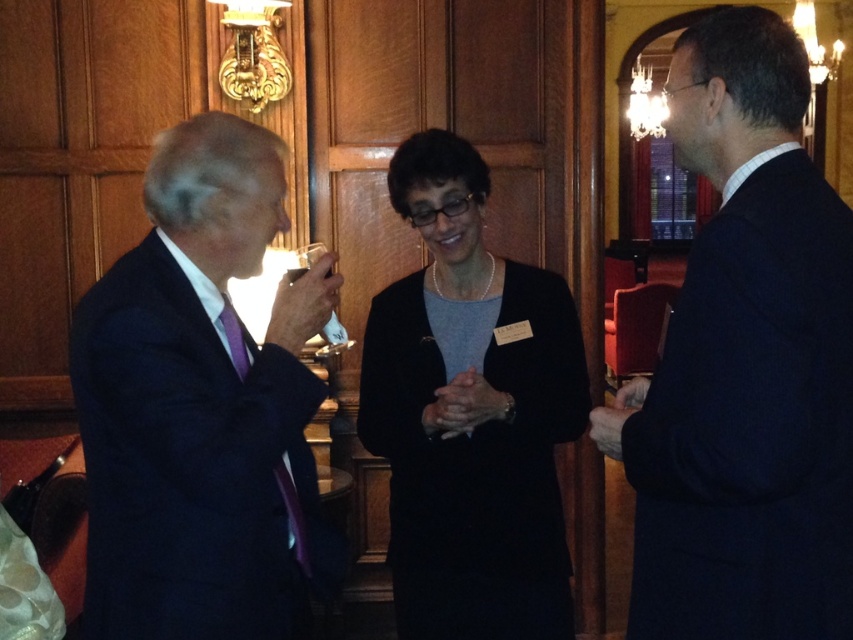
Between dark blue suit at left and matte black cardigan at center, which one appears on the right side from the viewer's perspective?

Positioned to the right is matte black cardigan at center.

Is point (291, 611) more distant than point (389, 432)?

That is False.

Is point (225, 420) positioned before point (450, 554)?

Yes, point (225, 420) is closer to viewer.

I want to click on dark blue suit at left, so click(202, 406).

Consider the image. Does dark blue suit at right have a greater height compared to matte black cardigan at center?

No, dark blue suit at right is not taller than matte black cardigan at center.

In the scene shown: Between dark blue suit at right and matte black cardigan at center, which one appears on the right side from the viewer's perspective?

From the viewer's perspective, dark blue suit at right appears more on the right side.

Between point (693, 65) and point (486, 493), which one is positioned in front?

Positioned in front is point (693, 65).

Where is `dark blue suit at right`? The width and height of the screenshot is (853, 640). dark blue suit at right is located at coordinates (746, 365).

Which is below, dark blue suit at right or dark blue suit at left?

dark blue suit at left is lower down.

In the scene shown: Can you confirm if dark blue suit at right is shorter than dark blue suit at left?

In fact, dark blue suit at right may be taller than dark blue suit at left.

Between point (753, 486) and point (192, 564), which one is positioned in front?

Point (753, 486)

The height and width of the screenshot is (640, 853). Find the location of `dark blue suit at right`. dark blue suit at right is located at coordinates (746, 365).